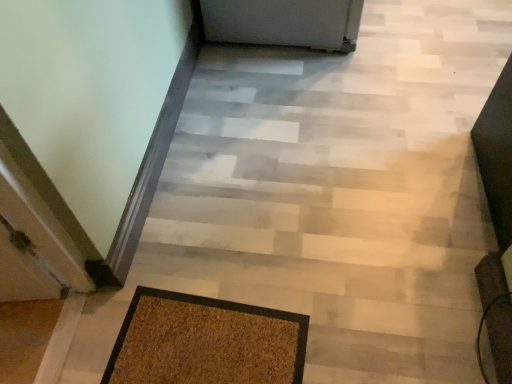
Measure the distance between point (215, 307) and camera.

The depth of point (215, 307) is 3.83 feet.

Describe the element at coordinates (206, 342) in the screenshot. I see `brown textured mat at lower center` at that location.

This screenshot has width=512, height=384. Find the location of `brown textured mat at lower center`. brown textured mat at lower center is located at coordinates (206, 342).

Where is `brown textured mat at lower center`? The image size is (512, 384). brown textured mat at lower center is located at coordinates (206, 342).